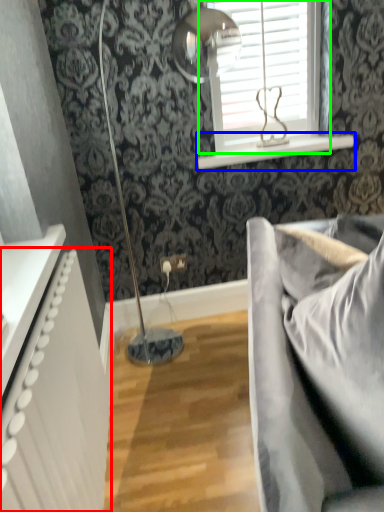
Question: Estimate the real-world distances between objects in this image. Which object is farther from radiator (highlighted by a red box), window sill (highlighted by a blue box) or window (highlighted by a green box)?

Choices:
 (A) window sill
 (B) window

Answer: (B)